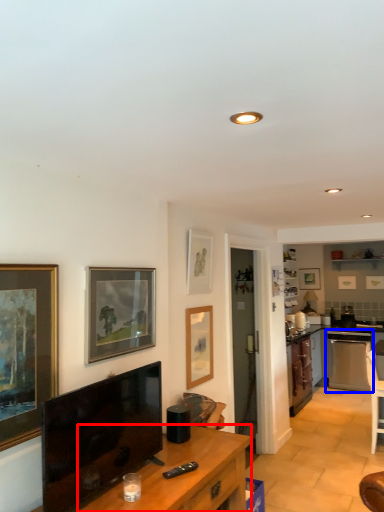
Question: Among these objects, which one is farthest to the camera, desk (highlighted by a red box) or dish washer (highlighted by a blue box)?

Choices:
 (A) desk
 (B) dish washer

Answer: (B)